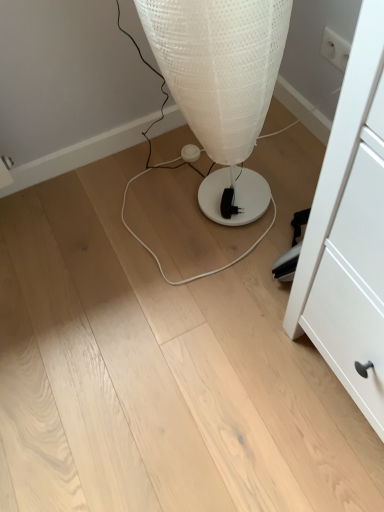
What is the approximate height of white matte lamp at center?

It is 26.72 inches.

Describe the element at coordinates (221, 83) in the screenshot. I see `white matte lamp at center` at that location.

You are a GUI agent. You are given a task and a screenshot of the screen. Output one action in this format:
    pyautogui.click(x=<x>, y=<y>)
    Task: Click on the white matte lamp at center
    
    Given the screenshot: What is the action you would take?
    pyautogui.click(x=221, y=83)

You are a GUI agent. You are given a task and a screenshot of the screen. Output one action in this format:
    pyautogui.click(x=<x>, y=<y>)
    Task: Click on the white matte lamp at center
    This screenshot has width=384, height=512.
    Given the screenshot: What is the action you would take?
    pyautogui.click(x=221, y=83)